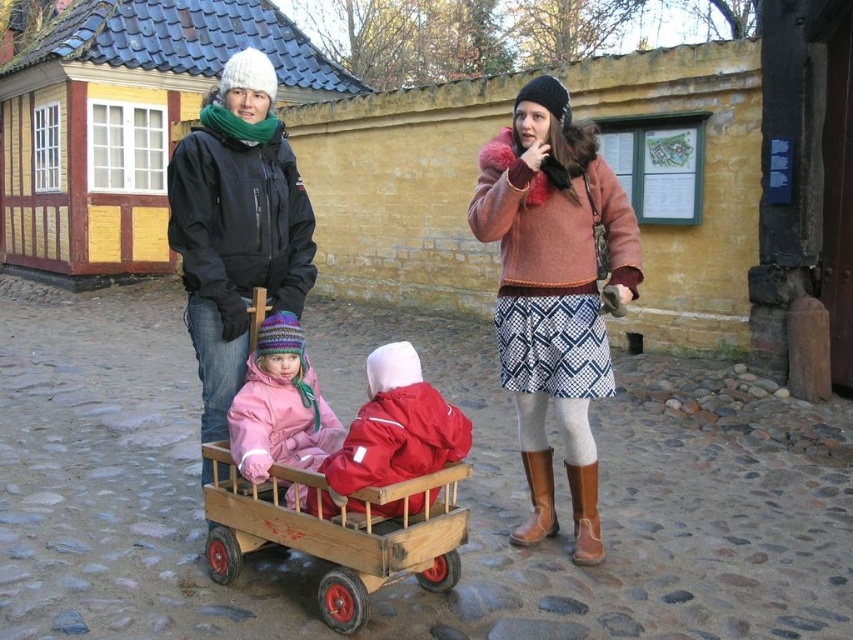
Question: Which point is closer to the camera?

Choices:
 (A) wooden wagon at center
 (B) matte pink snowsuit at center
 (C) rustic wool sweater at center

Answer: (A)

Question: Which is farther from the wooden wagon at center?

Choices:
 (A) red matte jacket at center
 (B) matte pink snowsuit at center

Answer: (B)

Question: Among these objects, which one is farthest from the camera?

Choices:
 (A) red matte jacket at center
 (B) matte pink snowsuit at center

Answer: (B)

Question: Where is wooden wagon at center located in relation to red matte jacket at center in the image?

Choices:
 (A) left
 (B) right

Answer: (A)

Question: Observing the image, what is the correct spatial positioning of wooden wagon at center in reference to matte pink snowsuit at center?

Choices:
 (A) left
 (B) right

Answer: (B)

Question: In this image, where is rustic wool sweater at center located relative to wooden wagon at center?

Choices:
 (A) left
 (B) right

Answer: (B)